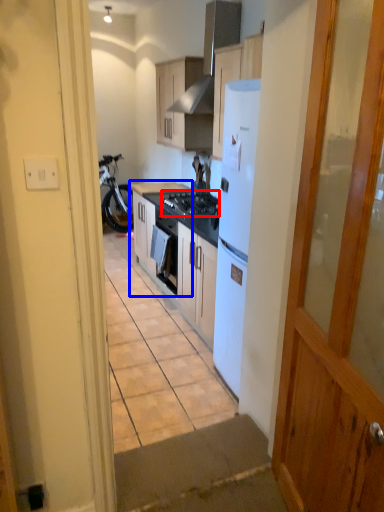
Question: Among these objects, which one is farthest to the camera, gas stove (highlighted by a red box) or cabinetry (highlighted by a blue box)?

Choices:
 (A) gas stove
 (B) cabinetry

Answer: (B)